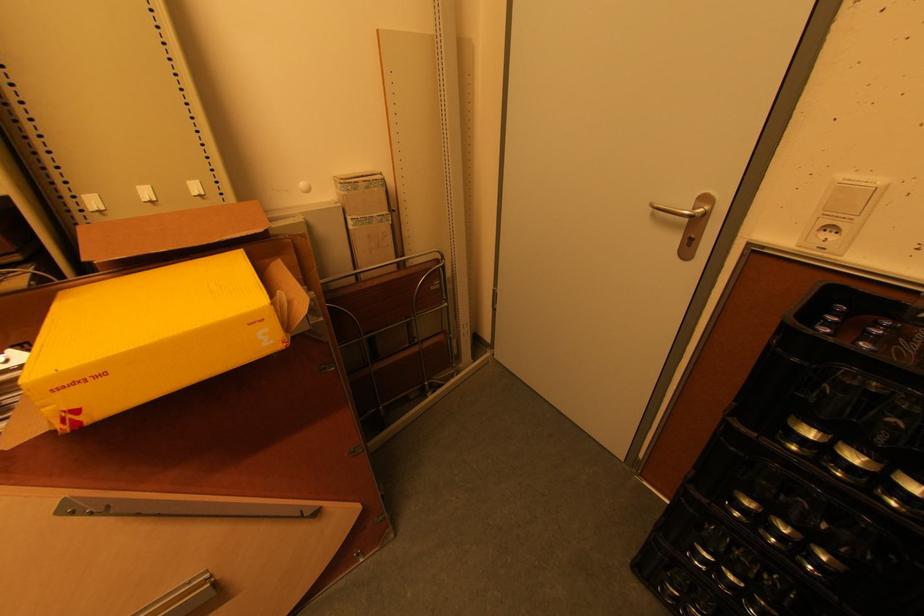
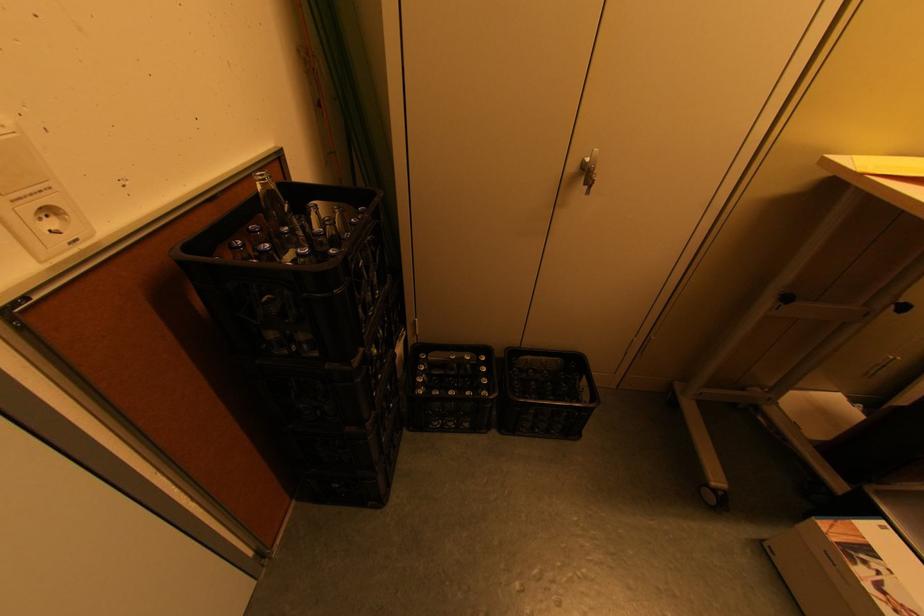
Where in the second image is the point corresponding to point 855,219 from the first image?

(54, 188)